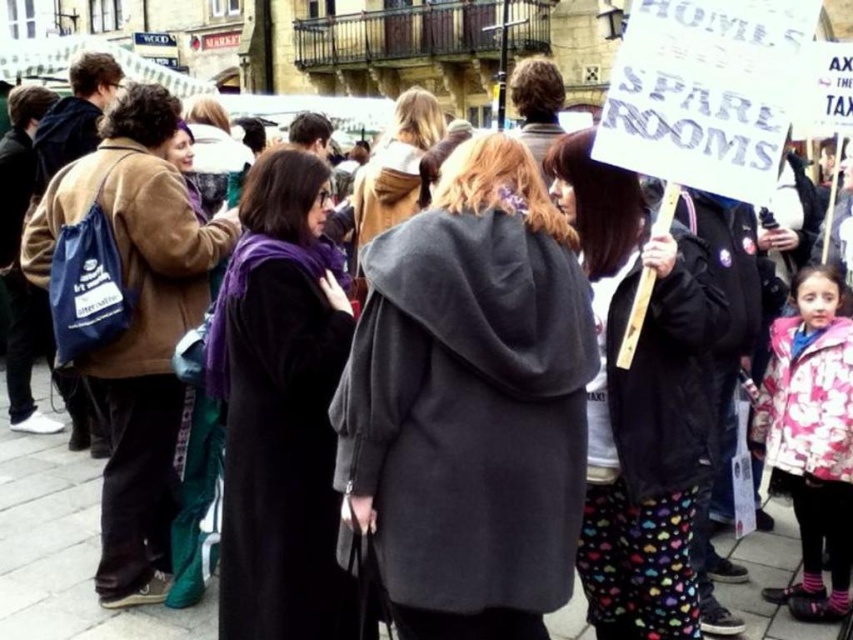
Question: Which object appears closest to the camera in this image?

Choices:
 (A) gray wool coat at center
 (B) white paper sign at center
 (C) dark gray wool coat at center

Answer: (C)

Question: Which of the following is the farthest from the observer?

Choices:
 (A) dark gray wool coat at center
 (B) purple velvet scarf at center
 (C) white paper sign at center
 (D) gray wool coat at center

Answer: (D)

Question: Can you confirm if dark gray wool coat at center is positioned below purple velvet scarf at center?

Choices:
 (A) no
 (B) yes

Answer: (A)

Question: Is pink floral coat at lower right bigger than gray wool coat at center?

Choices:
 (A) yes
 (B) no

Answer: (B)

Question: Is dark gray wool coat at center positioned in front of gray wool coat at center?

Choices:
 (A) no
 (B) yes

Answer: (B)

Question: Which of the following is the farthest from the observer?

Choices:
 (A) (618, 292)
 (B) (376, 184)
 (C) (250, 552)

Answer: (B)